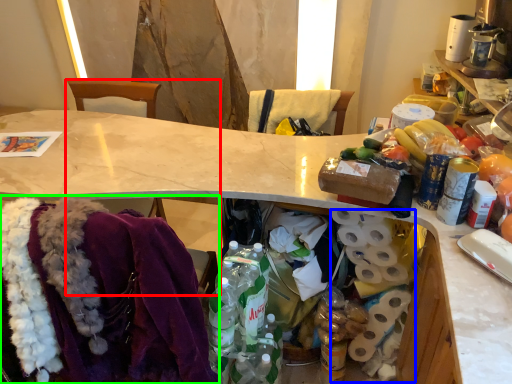
Question: Based on their relative distances, which object is nearer to chair (highlighted by a red box)? Choose from toilet paper (highlighted by a blue box) and clothing (highlighted by a green box).

Choices:
 (A) toilet paper
 (B) clothing

Answer: (B)